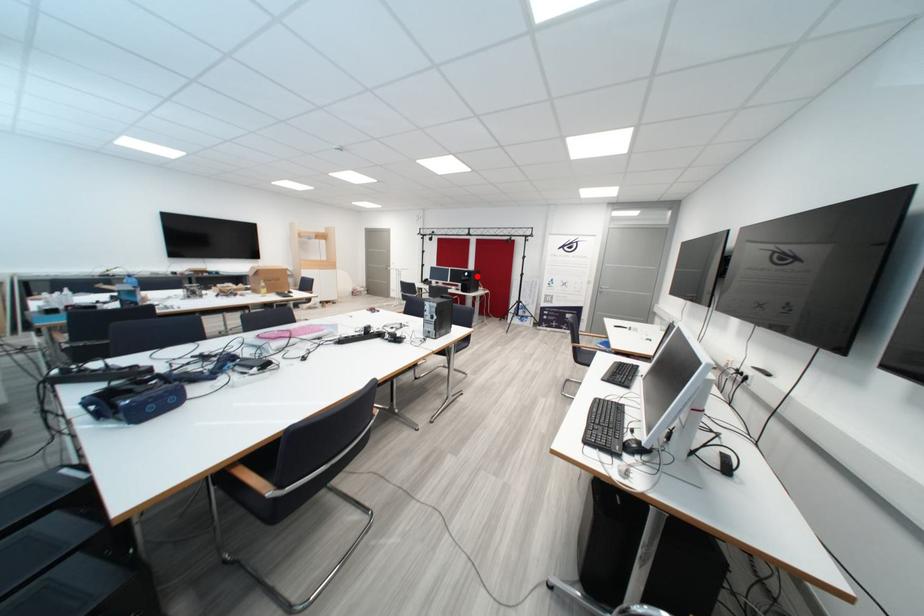
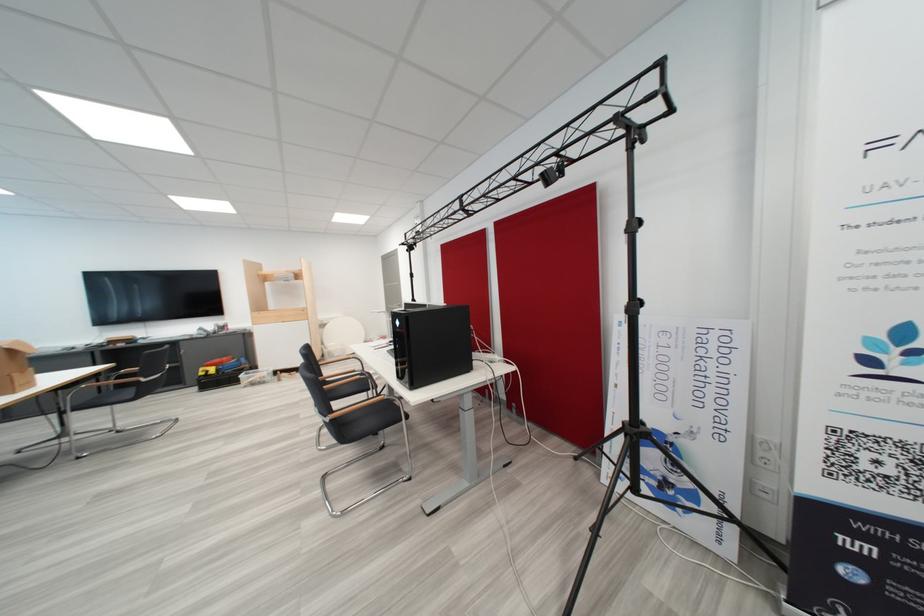
Where in the second image is the point corresponding to the highlighted location from the first image?

(407, 325)